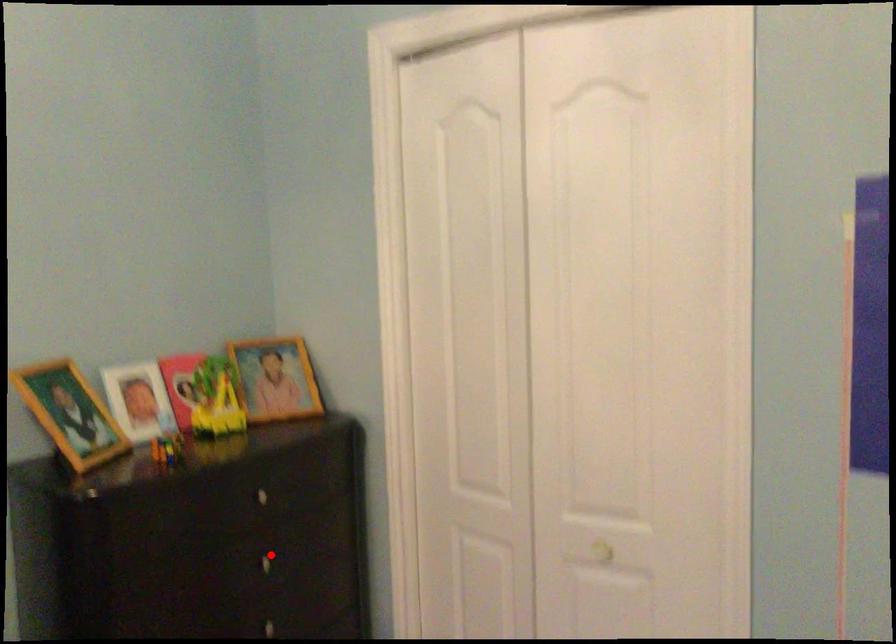
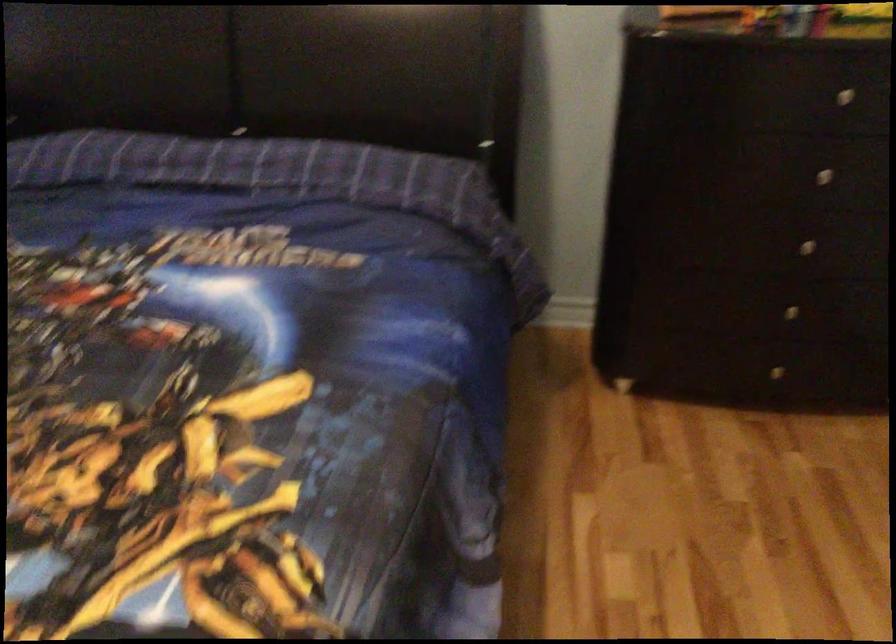
Question: I am providing you with two images of the same scene from different viewpoints. Given a red point in image1, look at the same physical point in image2. Is it:

Choices:
 (A) Closer to the viewpoint
 (B) Farther from the viewpoint

Answer: (A)